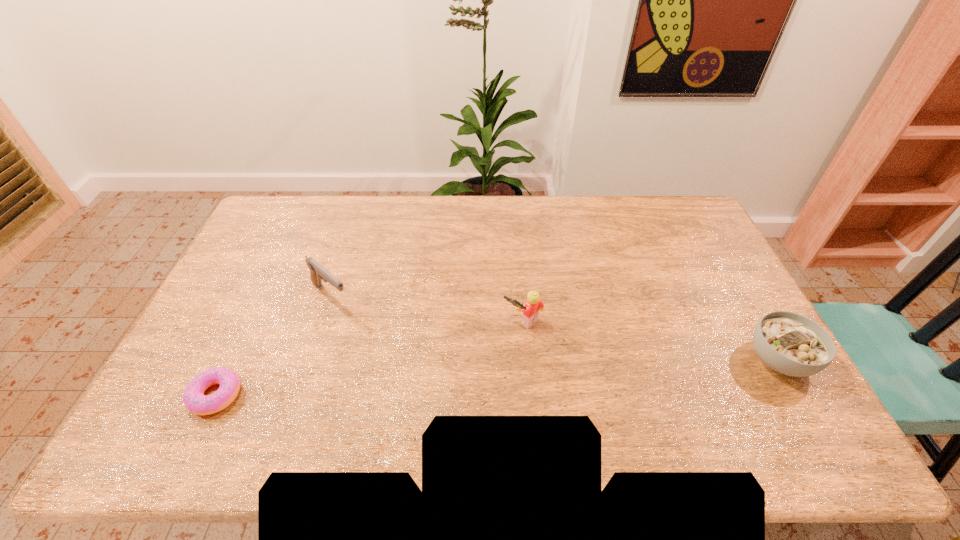
Locate an element on the screen. This screenshot has width=960, height=540. doughnut is located at coordinates (194, 399).

Find the location of a particular element. This screenshot has height=540, width=960. the leftmost object is located at coordinates (194, 399).

This screenshot has width=960, height=540. What are the coordinates of `soup bowl` in the screenshot? It's located at (789, 343).

Where is `the third object from right to left`? the third object from right to left is located at coordinates (317, 273).

The height and width of the screenshot is (540, 960). What are the coordinates of `pistol` in the screenshot? It's located at (317, 273).

The height and width of the screenshot is (540, 960). I want to click on Lego, so click(531, 309).

Where is `the second object from right to left`? the second object from right to left is located at coordinates pos(531,309).

The width and height of the screenshot is (960, 540). In order to click on vacant space located on the back of the shortest object in this screenshot , I will do `click(250, 323)`.

Locate an element on the screen. The width and height of the screenshot is (960, 540). free space located 0.400m on the back of the rightmost object is located at coordinates (712, 242).

Where is `vacant space located 0.400m at the barrel of the pistol`? This screenshot has width=960, height=540. vacant space located 0.400m at the barrel of the pistol is located at coordinates (436, 385).